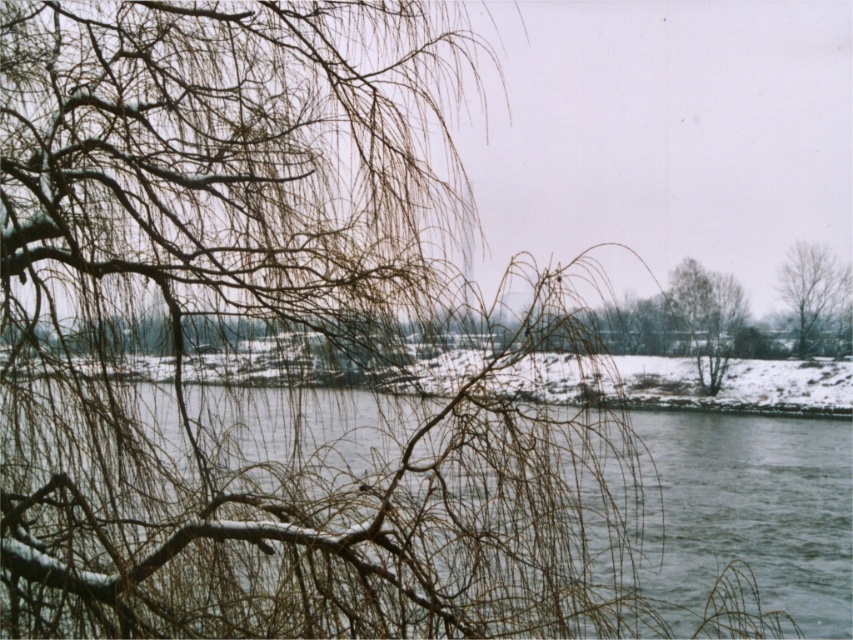
Question: Is green leafy tree at center bigger than bare branches at right?

Choices:
 (A) yes
 (B) no

Answer: (A)

Question: Does green leafy tree at center lie behind bare branches at right?

Choices:
 (A) no
 (B) yes

Answer: (A)

Question: Does green leafy tree at center have a smaller size compared to bare branches at right?

Choices:
 (A) no
 (B) yes

Answer: (A)

Question: Which point is farther from the camera taking this photo?

Choices:
 (A) (807, 296)
 (B) (363, 492)
 (C) (718, 300)

Answer: (A)

Question: Estimate the real-world distances between objects in this image. Which object is closer to the bare branches at right?

Choices:
 (A) green leafy tree at center
 (B) smooth gray water at center

Answer: (A)

Question: Which point is closer to the camera taking this photo?

Choices:
 (A) (692, 308)
 (B) (341, 445)
 (C) (844, 266)

Answer: (B)